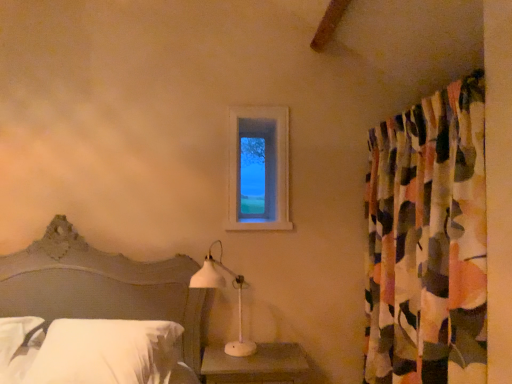
Question: Does white plastic table lamp at lower center lie in front of clear glass window at upper center?

Choices:
 (A) no
 (B) yes

Answer: (B)

Question: From the image's perspective, would you say white plastic table lamp at lower center is positioned over clear glass window at upper center?

Choices:
 (A) no
 (B) yes

Answer: (A)

Question: Does white plastic table lamp at lower center have a lesser height compared to clear glass window at upper center?

Choices:
 (A) yes
 (B) no

Answer: (A)

Question: From a real-world perspective, is white plastic table lamp at lower center located higher than clear glass window at upper center?

Choices:
 (A) no
 (B) yes

Answer: (A)

Question: Is white plastic table lamp at lower center taller than clear glass window at upper center?

Choices:
 (A) no
 (B) yes

Answer: (A)

Question: Does white plastic table lamp at lower center turn towards clear glass window at upper center?

Choices:
 (A) yes
 (B) no

Answer: (B)

Question: Can you confirm if matte gray headboard at lower left is thinner than white soft pillow at lower left?

Choices:
 (A) yes
 (B) no

Answer: (B)

Question: Can you confirm if matte gray headboard at lower left is positioned to the left of white soft pillow at lower left?

Choices:
 (A) no
 (B) yes

Answer: (B)

Question: From the image's perspective, would you say matte gray headboard at lower left is positioned over white soft pillow at lower left?

Choices:
 (A) yes
 (B) no

Answer: (A)

Question: Are matte gray headboard at lower left and white soft pillow at lower left far apart?

Choices:
 (A) yes
 (B) no

Answer: (B)

Question: Is matte gray headboard at lower left looking in the opposite direction of white soft pillow at lower left?

Choices:
 (A) yes
 (B) no

Answer: (A)

Question: Is matte gray headboard at lower left taller than white soft pillow at lower left?

Choices:
 (A) no
 (B) yes

Answer: (B)

Question: From a real-world perspective, is white plastic table lamp at lower center below white soft pillow at lower left?

Choices:
 (A) yes
 (B) no

Answer: (B)